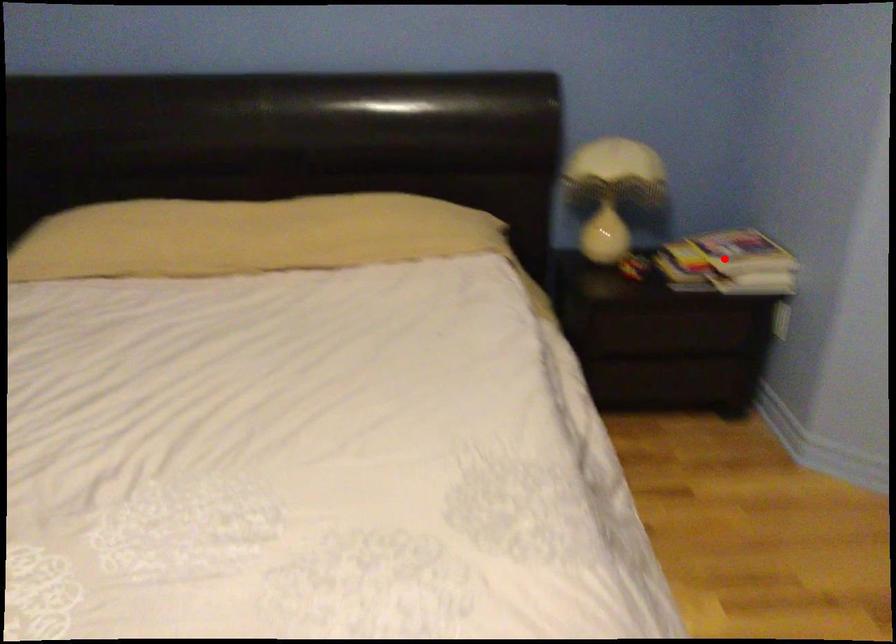
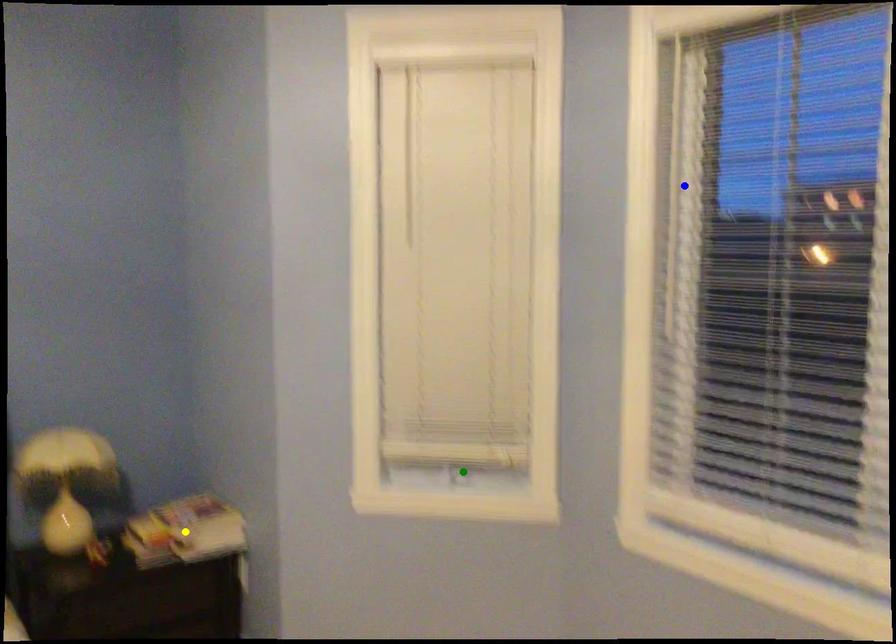
Question: I am providing you with two images of the same scene from different viewpoints. A red point is marked on the first image. You are given multiple points on the second image. Which point in image 2 represents the same 3d spot as the red point in image 1?

Choices:
 (A) yellow point
 (B) green point
 (C) blue point

Answer: (A)